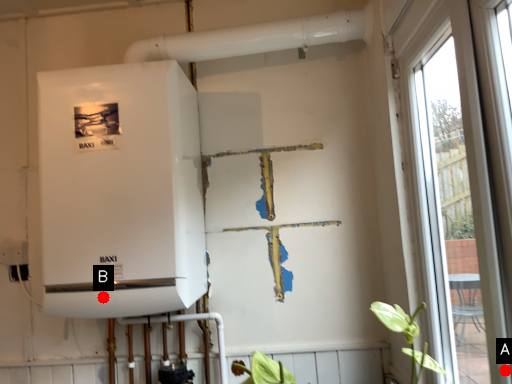
Question: Two points are circled on the image, labeled by A and B beside each circle. Which point is farther from the camera taking this photo?

Choices:
 (A) A is further
 (B) B is further

Answer: (B)